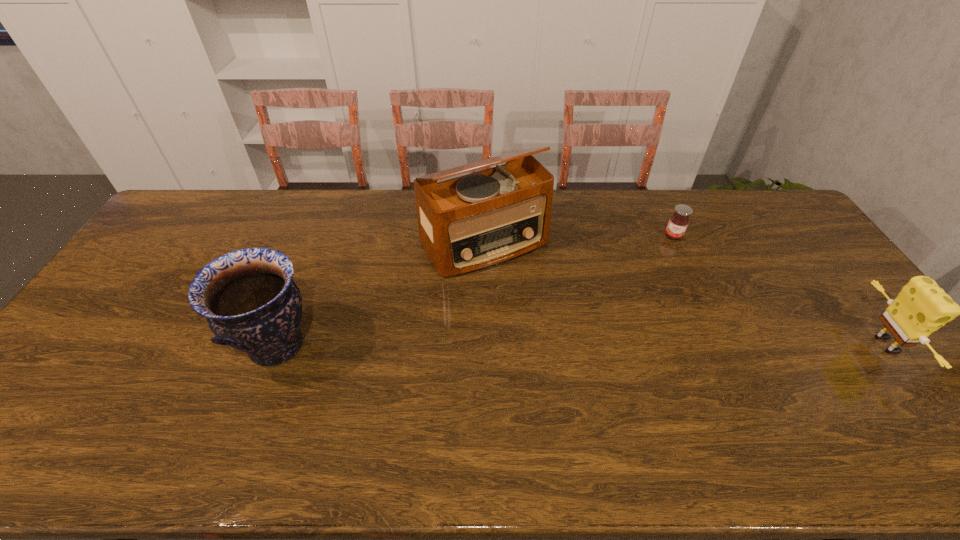
The width and height of the screenshot is (960, 540). What are the coordinates of `the third closest object to the jam` in the screenshot? It's located at (251, 303).

The width and height of the screenshot is (960, 540). I want to click on vacant space that satisfies the following two spatial constraints: 1. on the front side of the second shortest object; 2. on the face of the shortest object, so click(724, 345).